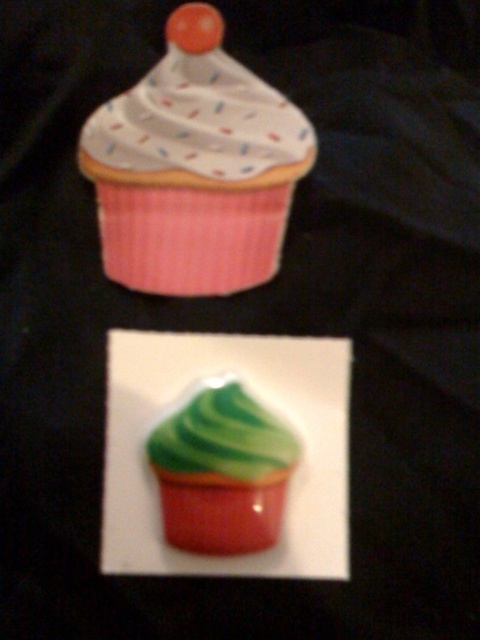
Can you confirm if white dotted frosting at upper center is positioned to the right of green glossy cupcake at center?

In fact, white dotted frosting at upper center is to the left of green glossy cupcake at center.

Between white dotted frosting at upper center and green glossy cupcake at center, which one appears on the right side from the viewer's perspective?

green glossy cupcake at center is more to the right.

Is point (204, 88) positioned behind point (262, 525)?

Yes, it is.

At what (x,y) coordinates should I click in order to perform the action: click on white dotted frosting at upper center. Please return your answer as a coordinate pair (x, y). This screenshot has height=640, width=480. Looking at the image, I should click on (197, 129).

Can you confirm if matte pink cupcake at upper center is thinner than white dotted frosting at upper center?

Yes.

Is point (217, 12) less distant than point (253, 93)?

Yes, it is.

Is point (93, 150) farther from viewer compared to point (242, 100)?

That is False.

Find the location of a particular element. This screenshot has height=640, width=480. matte pink cupcake at upper center is located at coordinates (194, 168).

Who is positioned more to the right, matte pink cupcake at upper center or green glossy cupcake at center?

From the viewer's perspective, green glossy cupcake at center appears more on the right side.

Does matte pink cupcake at upper center have a lesser height compared to green glossy cupcake at center?

No, matte pink cupcake at upper center is not shorter than green glossy cupcake at center.

At what (x,y) coordinates should I click in order to perform the action: click on matte pink cupcake at upper center. Please return your answer as a coordinate pair (x, y). Looking at the image, I should click on (194, 168).